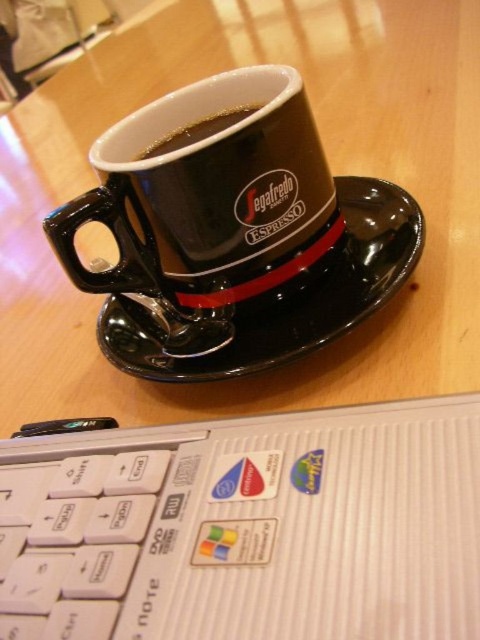
Question: Which point is farther to the camera?

Choices:
 (A) (202, 368)
 (B) (123, 248)
 (C) (201, 67)
 (D) (244, 109)

Answer: (C)

Question: Can you confirm if wooden table at center is positioned below glossy ceramic mug at center?

Choices:
 (A) yes
 (B) no

Answer: (B)

Question: Can you confirm if wooden table at center is smaller than black glossy saucer at center?

Choices:
 (A) yes
 (B) no

Answer: (B)

Question: Which object is farther from the camera taking this photo?

Choices:
 (A) glossy ceramic mug at center
 (B) black glossy cup at upper center
 (C) wooden table at center
 (D) black glossy saucer at center

Answer: (B)

Question: Considering the relative positions of wooden table at center and glossy ceramic mug at center in the image provided, where is wooden table at center located with respect to glossy ceramic mug at center?

Choices:
 (A) right
 (B) left

Answer: (B)

Question: Estimate the real-world distances between objects in this image. Which object is closer to the black glossy saucer at center?

Choices:
 (A) wooden table at center
 (B) glossy ceramic mug at center
 (C) black glossy cup at upper center

Answer: (B)